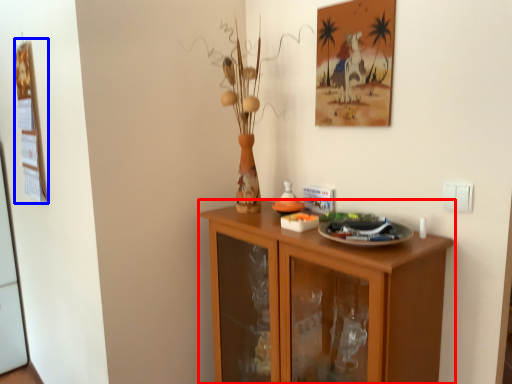
Question: Among these objects, which one is nearest to the camera, cabinetry (highlighted by a red box) or picture frame (highlighted by a blue box)?

Choices:
 (A) cabinetry
 (B) picture frame

Answer: (A)